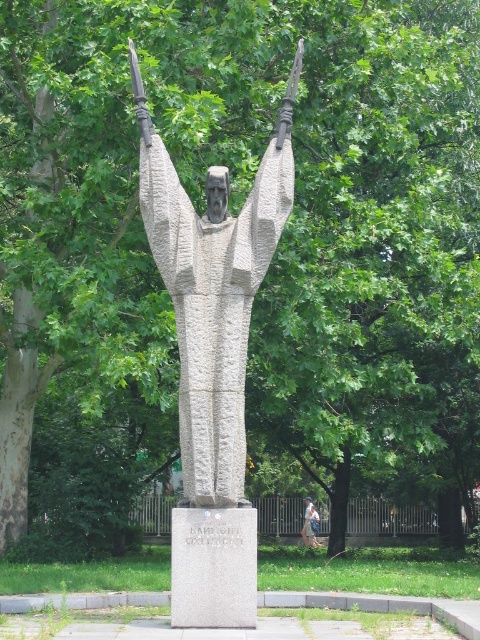
Question: Does gray stone statue at center appear on the left side of light blue denim jeans at center?

Choices:
 (A) no
 (B) yes

Answer: (B)

Question: Is gray stone statue at center closer to camera compared to light blue denim jeans at center?

Choices:
 (A) yes
 (B) no

Answer: (A)

Question: Which point is closer to the camera?

Choices:
 (A) light blue denim jeans at center
 (B) gray stone statue at center

Answer: (B)

Question: Which point is closer to the camera?

Choices:
 (A) (317, 545)
 (B) (172, 198)

Answer: (B)

Question: Can you confirm if gray stone statue at center is smaller than light blue denim jeans at center?

Choices:
 (A) yes
 (B) no

Answer: (B)